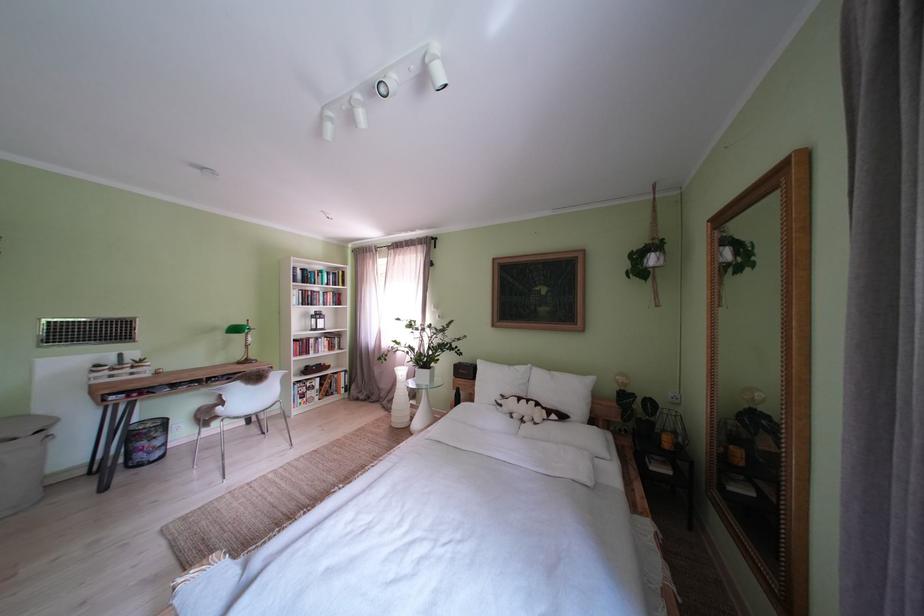
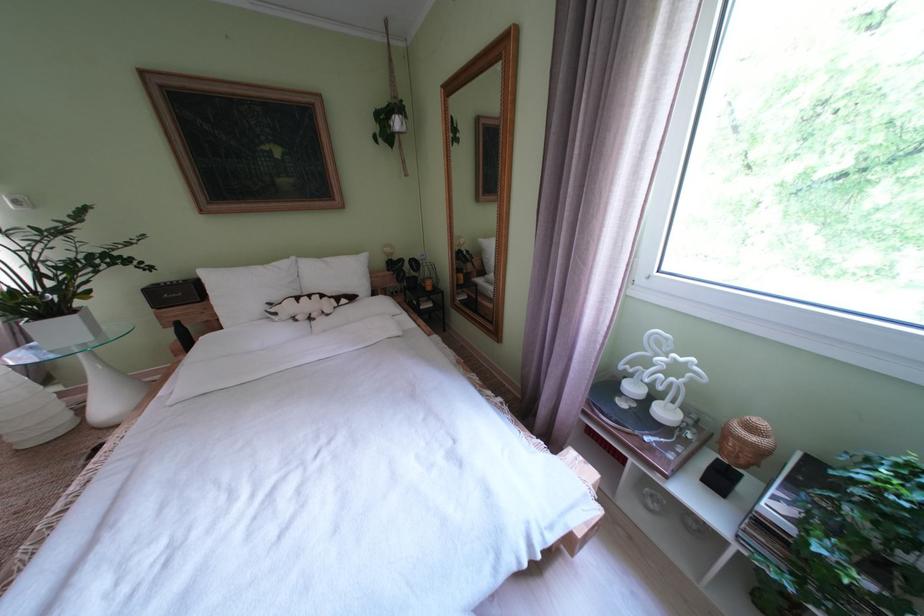
The first image is from the beginning of the video and the second image is from the end. How did the camera likely rotate when shooting the video?

The camera rotated toward right-down.